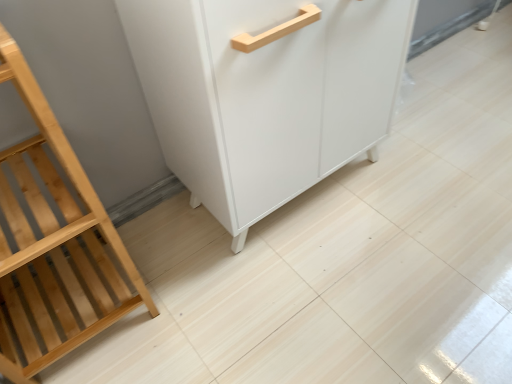
Locate an element on the screen. vacant area that is in front of white matte cabinet at center is located at coordinates (321, 302).